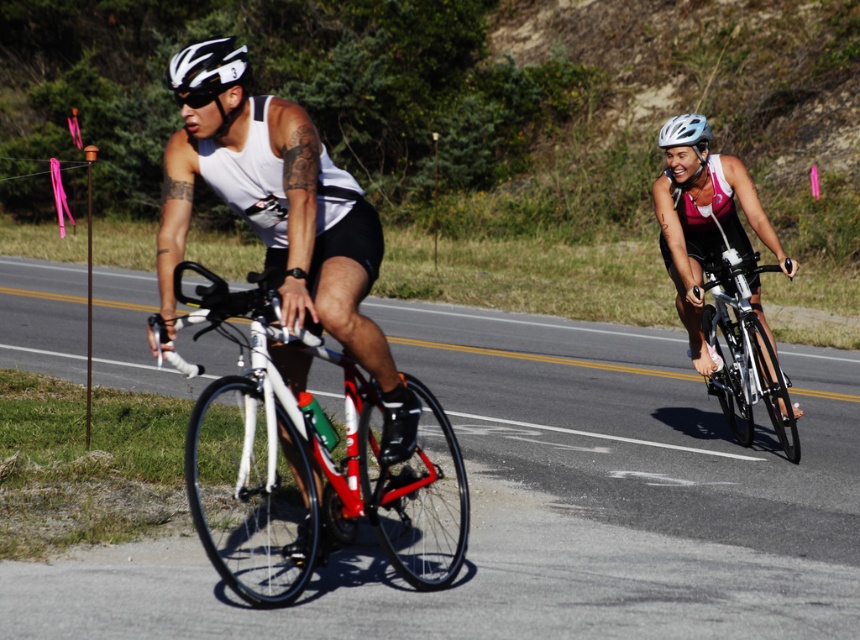
You are a photographer capturing the cyclists from the side of the road. You need to ensure both the matte pink tri suit at right and the white matte bicycle helmet at upper left are clearly visible in the frame. Based on their sizes, which object should you focus on first to ensure it fits within the camera view?

The matte pink tri suit at right is larger in width than the white matte bicycle helmet at upper left. Therefore, you should focus on the matte pink tri suit at right first to ensure it fits within the camera view, as its larger size requires more attention to framing.

You are a spectator watching the cyclists from the roadside. You notice the matte pink tri suit at right and the white matte bicycle helmet at upper left. Which object is positioned lower in the image?

The matte pink tri suit at right is below the white matte bicycle helmet at upper left, so the matte pink tri suit at right is positioned lower in the image.

You are a photographer positioned at the starting line of a cycling event. You need to capture a photo that includes both the matte pink tri suit at right and the white matte bicycle helmet at upper left. Based on their sizes, which object should you focus on first to ensure both are in frame?

The matte pink tri suit at right is larger in size compared to the white matte bicycle helmet at upper left, so you should focus on the matte pink tri suit at right first to ensure both are in frame.